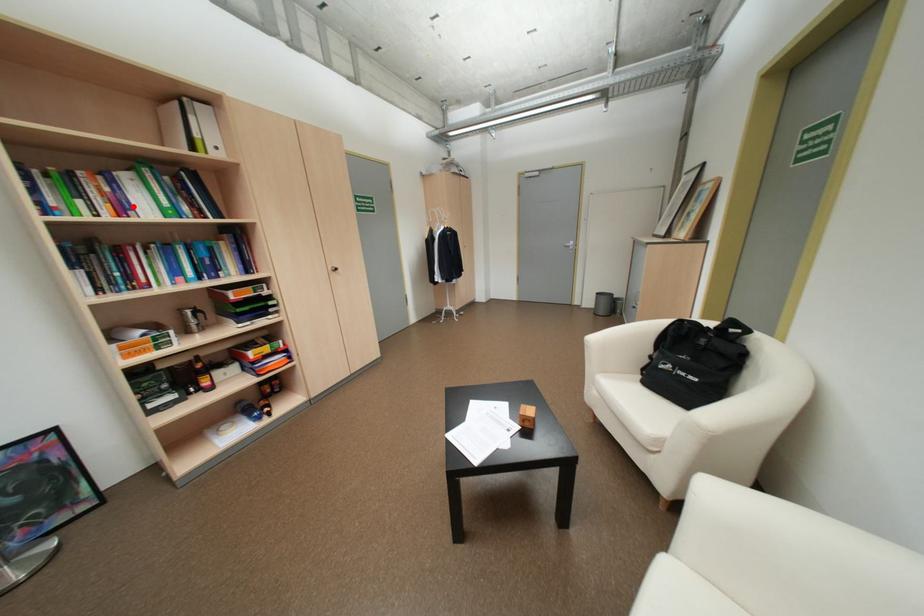
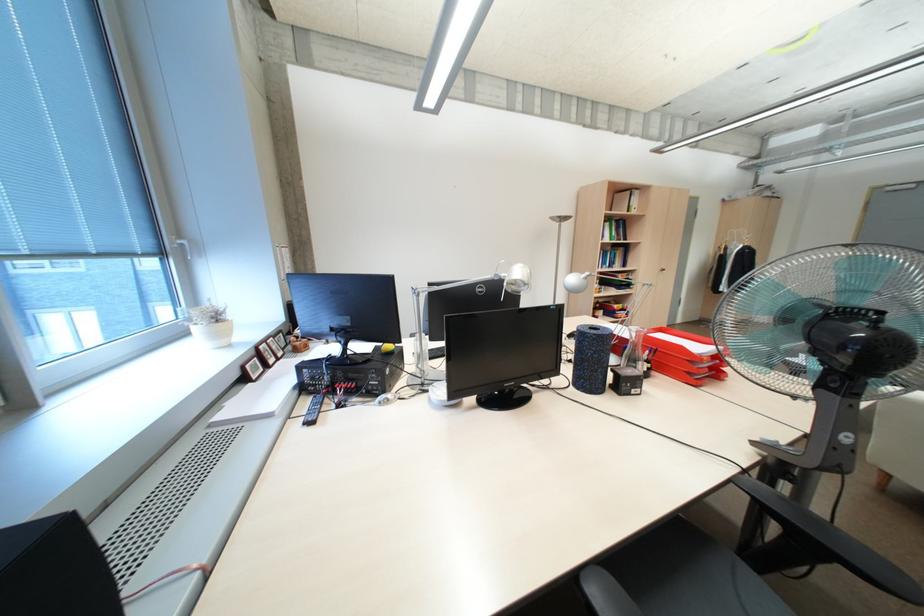
Question: I am providing you with two images of the same scene from different viewpoints. Given a red point in image1, look at the same physical point in image2. Is it:

Choices:
 (A) Closer to the viewpoint
 (B) Farther from the viewpoint

Answer: (A)